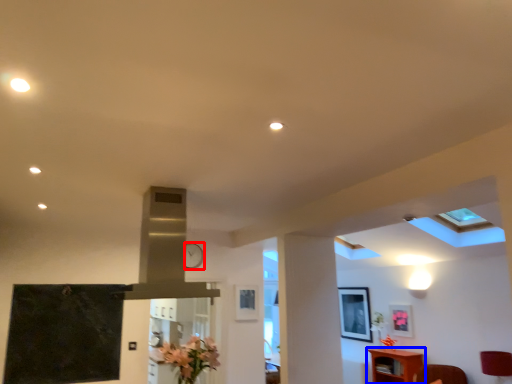
Question: Which point is closer to the camera, clock (highlighted by a red box) or furniture (highlighted by a blue box)?

Choices:
 (A) clock
 (B) furniture

Answer: (A)